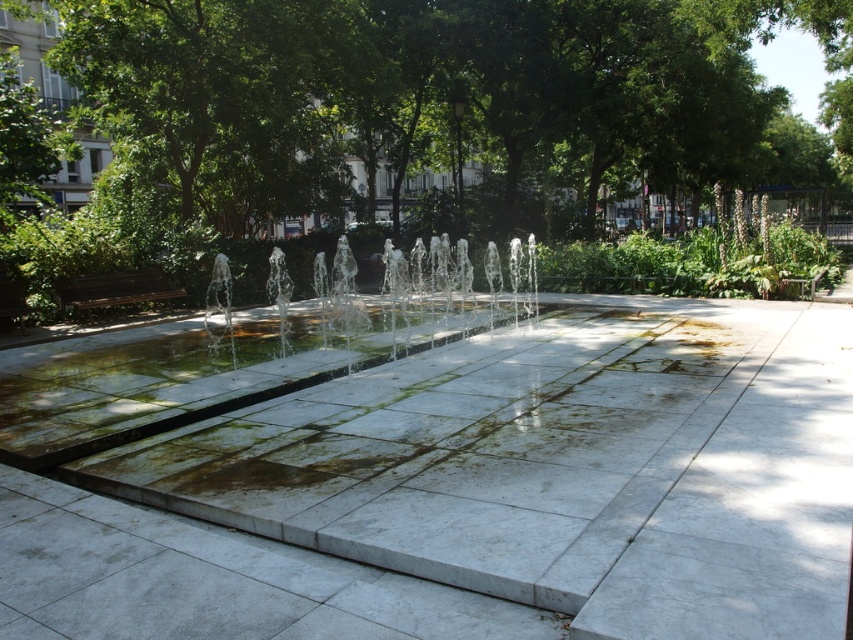
Question: From the image, what is the correct spatial relationship of white marble pavement at center in relation to clear glass water jets at center?

Choices:
 (A) left
 (B) right

Answer: (B)

Question: Does green leafy tree at center lie in front of clear glass water jets at center?

Choices:
 (A) no
 (B) yes

Answer: (A)

Question: Is white marble pavement at center to the left of clear glass water jets at center from the viewer's perspective?

Choices:
 (A) no
 (B) yes

Answer: (A)

Question: Which of the following is the farthest from the observer?

Choices:
 (A) green leafy tree at center
 (B) white marble pavement at center

Answer: (A)

Question: Which object is farther from the camera taking this photo?

Choices:
 (A) green leafy tree at center
 (B) white marble pavement at center
 (C) clear glass water jets at center

Answer: (A)

Question: Which object appears farthest from the camera in this image?

Choices:
 (A) green leafy tree at center
 (B) clear glass water jets at center

Answer: (A)